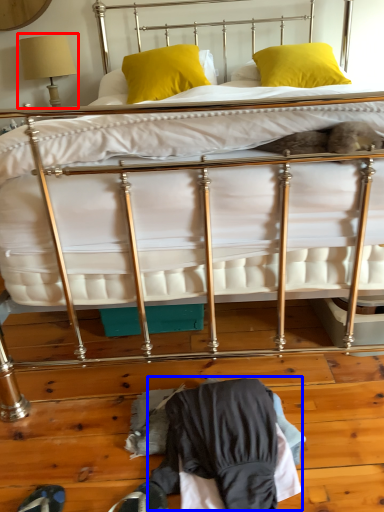
Question: Which object appears farthest to the camera in this image, table lamp (highlighted by a red box) or clothing (highlighted by a blue box)?

Choices:
 (A) table lamp
 (B) clothing

Answer: (A)